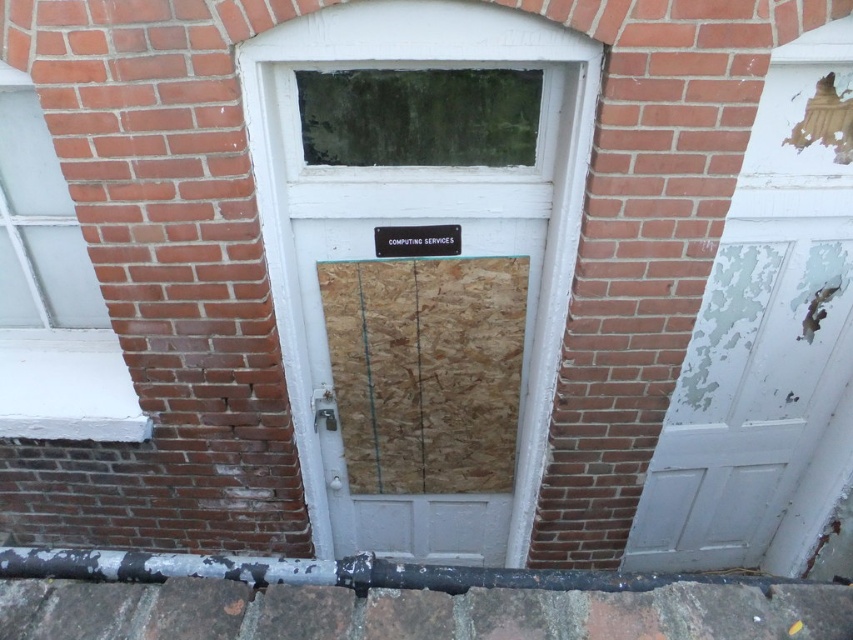
You are an inspector assessing the building exterior. You notice the white peeling paint door at right and the black plastic sign at center. Which object is taller?

The white peeling paint door at right is taller than the black plastic sign at center.

You are a painter standing in front of the building and want to touch both the white peeling paint door at right and the black plastic sign at center. Which object will you reach first?

The white peeling paint door at right is closer to the viewer than the black plastic sign at center, so you will reach the white peeling paint door at right first.

You are a window cleaner with a ladder that can extend up to 1 meter. You need to clean both the white painted glass at left and the black plastic sign at center. Can you reach both items with your ladder without moving it?

The distance between the white painted glass at left and the black plastic sign at center is 1.01 meters. Since your ladder can only extend up to 1 meter, you cannot reach both items without moving the ladder.